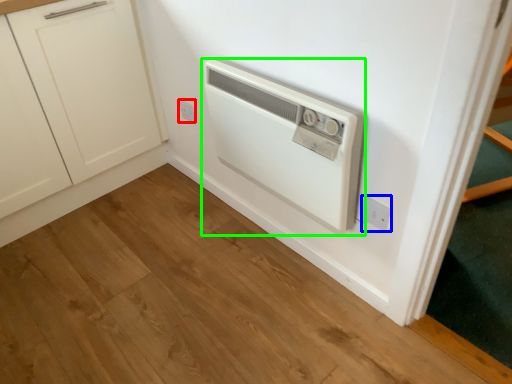
Question: Estimate the real-world distances between objects in this image. Which object is closer to electric outlet (highlighted by a red box), electric outlet (highlighted by a blue box) or home appliance (highlighted by a green box)?

Choices:
 (A) electric outlet
 (B) home appliance

Answer: (B)